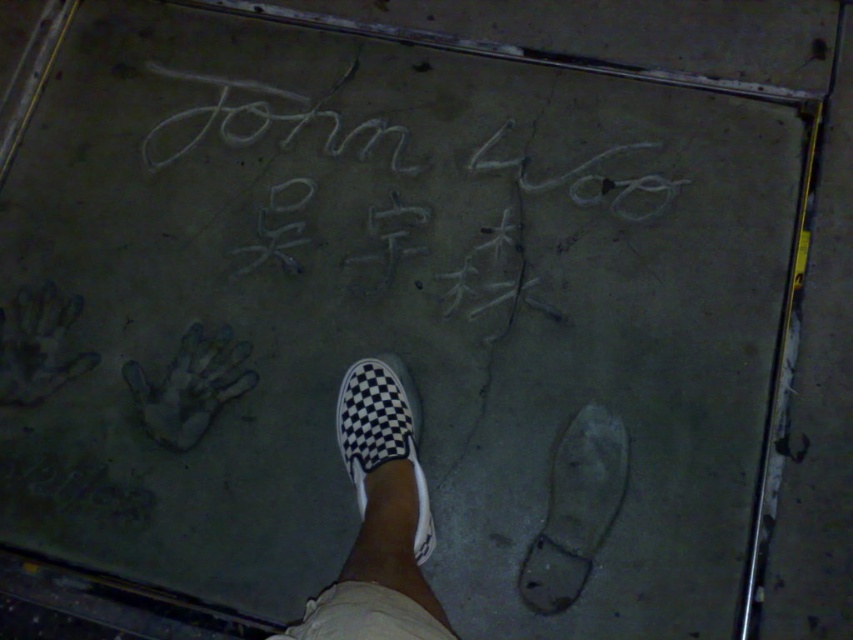
Question: Which of the following is the closest to the observer?

Choices:
 (A) white checkered slip-on at center
 (B) white chalk writing at center
 (C) white rubber footprint at lower center
 (D) black checkered slip-on shoe at center

Answer: (D)

Question: Does black checkered slip-on shoe at center come in front of white checkered slip-on at center?

Choices:
 (A) yes
 (B) no

Answer: (A)

Question: Which object is farther from the camera taking this photo?

Choices:
 (A) white rubber footprint at lower center
 (B) black checkered slip-on shoe at center
 (C) white chalk writing at center

Answer: (C)

Question: Based on their relative distances, which object is nearer to the white chalk writing at center?

Choices:
 (A) black checkered slip-on shoe at center
 (B) white checkered slip-on at center
 (C) white rubber footprint at lower center

Answer: (B)

Question: Is white rubber footprint at lower center positioned in front of white checkered slip-on at center?

Choices:
 (A) yes
 (B) no

Answer: (B)

Question: Is white rubber footprint at lower center below white chalk writing at center?

Choices:
 (A) no
 (B) yes

Answer: (B)